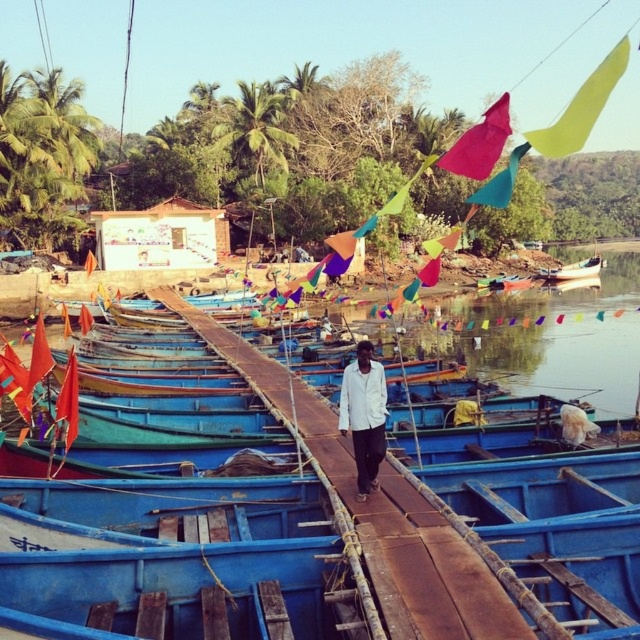
Question: Considering the real-world distances, which object is closest to the rusty wood dock at center?

Choices:
 (A) white glossy boat at right
 (B) white matte shirt at center

Answer: (B)

Question: Is white matte shirt at center below white glossy boat at right?

Choices:
 (A) yes
 (B) no

Answer: (A)

Question: Does rusty wood dock at center appear on the left side of white glossy boat at right?

Choices:
 (A) yes
 (B) no

Answer: (A)

Question: Which point is farther from the camera taking this photo?

Choices:
 (A) (376, 560)
 (B) (580, 262)
 (C) (369, 344)

Answer: (B)

Question: Which is farther from the white matte shirt at center?

Choices:
 (A) rusty wood dock at center
 (B) white glossy boat at right

Answer: (B)

Question: Does rusty wood dock at center appear over white matte shirt at center?

Choices:
 (A) no
 (B) yes

Answer: (A)